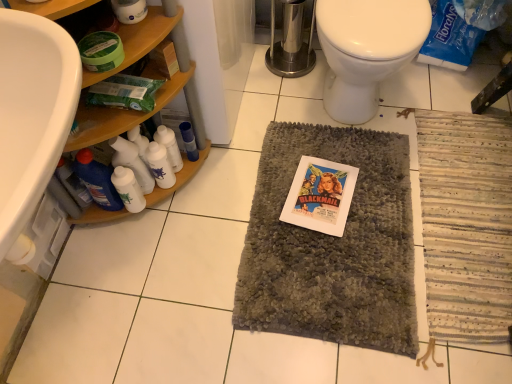
Where is `vacant area that lies between blue plastic bottle at center, which is the 5th bottle from left to right, and striped fabric bath mat at lower right`? The height and width of the screenshot is (384, 512). vacant area that lies between blue plastic bottle at center, which is the 5th bottle from left to right, and striped fabric bath mat at lower right is located at coordinates (354, 195).